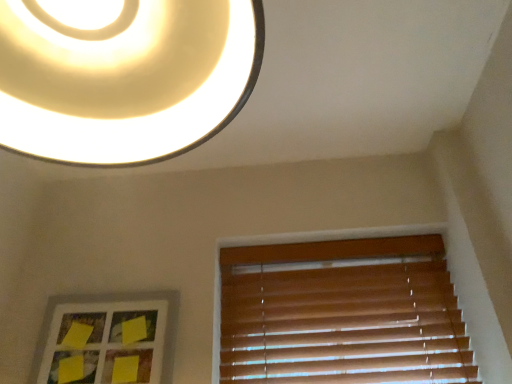
Question: In terms of width, does wooden blinds at lower right look wider or thinner when compared to matte white lampshade at upper center?

Choices:
 (A) wide
 (B) thin

Answer: (B)

Question: From a real-world perspective, is wooden blinds at lower right above or below matte white lampshade at upper center?

Choices:
 (A) above
 (B) below

Answer: (B)

Question: Estimate the real-world distances between objects in this image. Which object is closer to the matte white lampshade at upper center?

Choices:
 (A) yellow paper at lower left
 (B) wooden blinds at lower right

Answer: (A)

Question: Estimate the real-world distances between objects in this image. Which object is closer to the wooden blinds at lower right?

Choices:
 (A) matte white lampshade at upper center
 (B) yellow paper at lower left

Answer: (B)